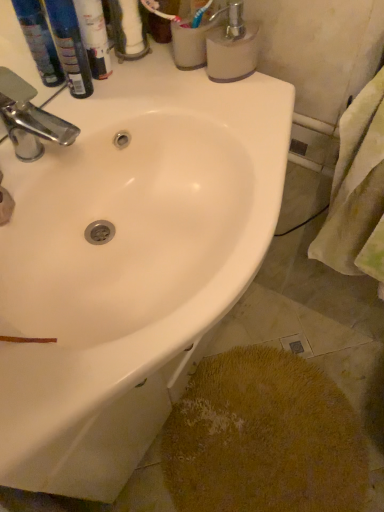
This screenshot has height=512, width=384. Identify the location of free space in front of blue plastic bottles at upper left, marked as the first toiletry in a left-to-right arrangement. (72, 124).